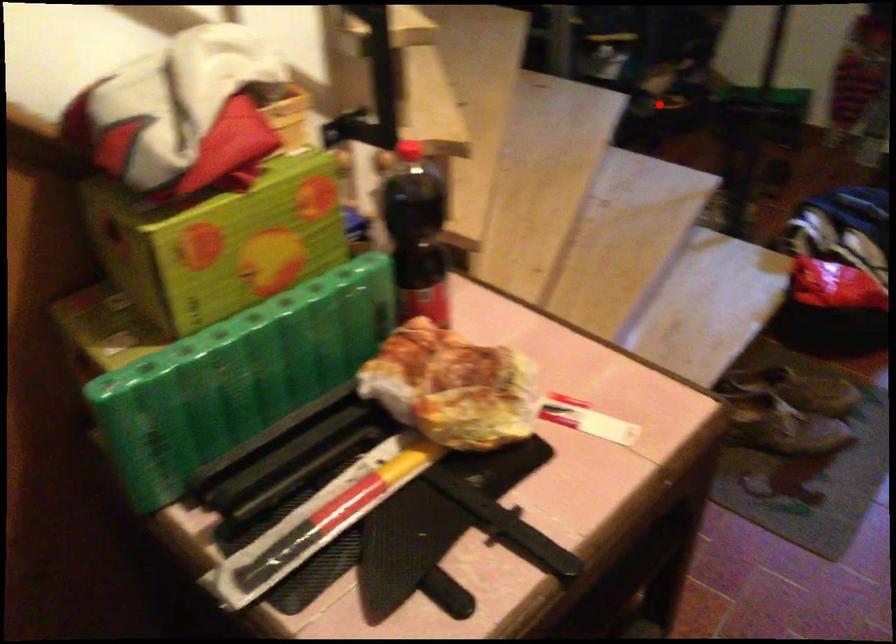
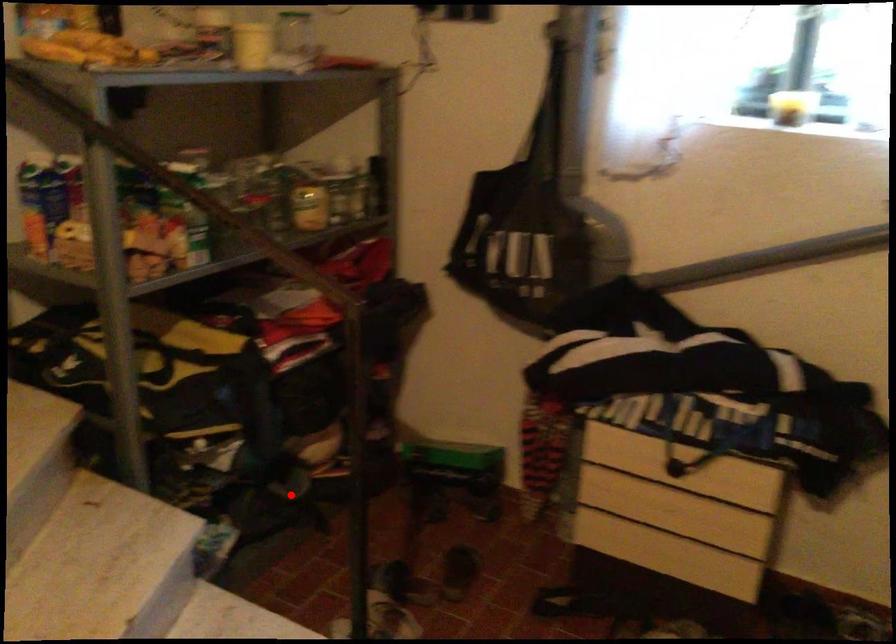
I am providing you with two images of the same scene from different viewpoints. A red point is marked on the first image and another point is marked on the second image. Is the marked point in image1 the same physical position as the marked point in image2?

Yes